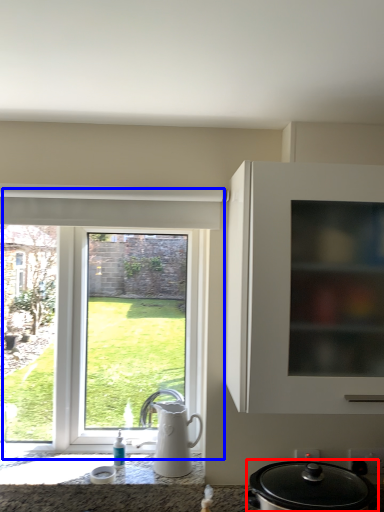
Question: Which object appears closest to the camera in this image, kitchen appliance (highlighted by a red box) or window (highlighted by a blue box)?

Choices:
 (A) kitchen appliance
 (B) window

Answer: (A)